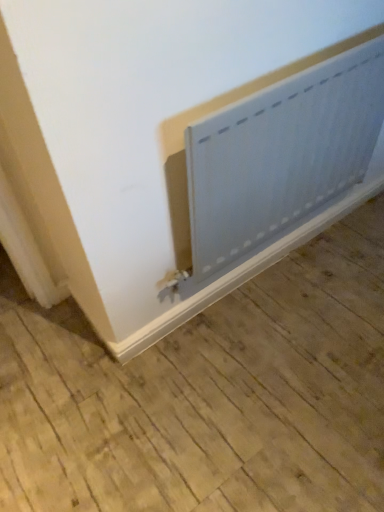
Locate an element on the screen. The image size is (384, 512). free location above matte gray radiator at lower right (from a real-world perspective) is located at coordinates click(x=242, y=358).